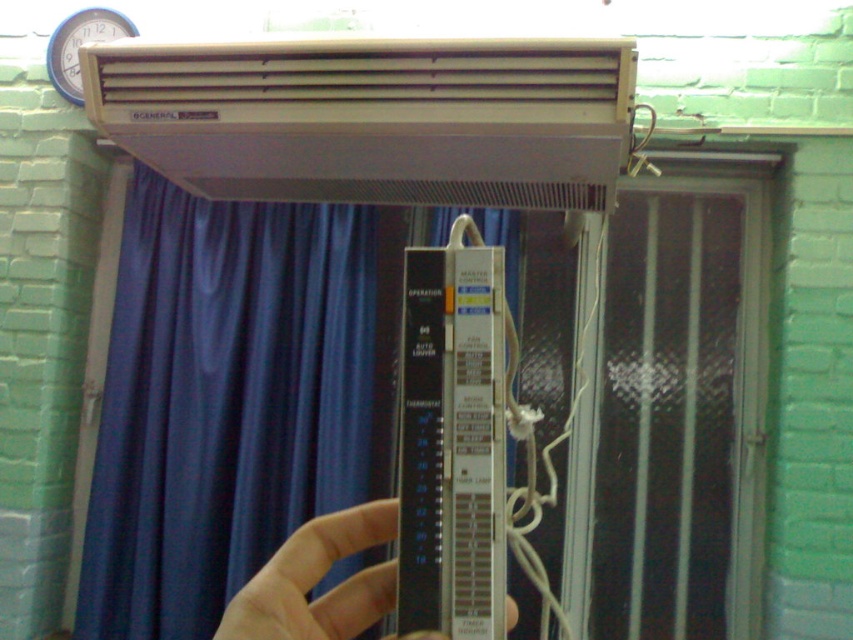
Does blue satin curtain at center have a greater width compared to beige plastic air conditioner at upper center?

Yes.

Between point (364, 468) and point (207, 116), which one is positioned in front?

Point (207, 116)

The width and height of the screenshot is (853, 640). Find the location of `blue satin curtain at center`. blue satin curtain at center is located at coordinates (231, 397).

Can you confirm if beige plastic air conditioner at upper center is bigger than slightly translucent plastic at center?

Yes, beige plastic air conditioner at upper center is bigger than slightly translucent plastic at center.

Find the location of `beige plastic air conditioner at upper center`. beige plastic air conditioner at upper center is located at coordinates (373, 118).

This screenshot has width=853, height=640. What are the coordinates of `beige plastic air conditioner at upper center` in the screenshot? It's located at (373, 118).

Which is behind, point (141, 289) or point (387, 502)?

Point (141, 289)

Does point (204, 596) come in front of point (346, 536)?

That is False.

Locate an element on the screen. Image resolution: width=853 pixels, height=640 pixels. blue satin curtain at center is located at coordinates (231, 397).